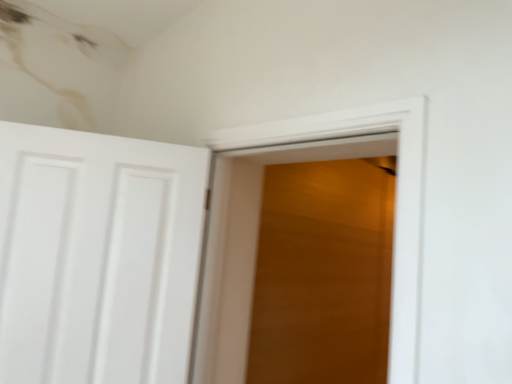
The height and width of the screenshot is (384, 512). Identify the location of wooden door at center. (256, 239).

Image resolution: width=512 pixels, height=384 pixels. Describe the element at coordinates (256, 239) in the screenshot. I see `wooden door at center` at that location.

Identify the location of wooden door at center. (256, 239).